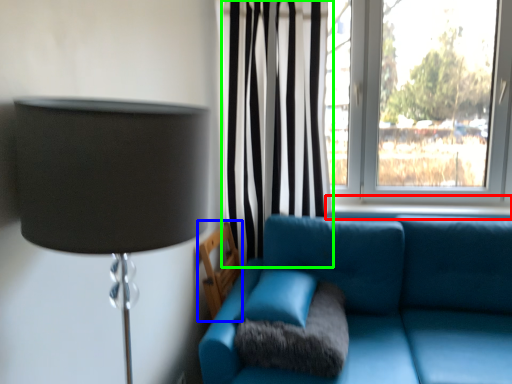
Question: Which object is positioned farthest from window sill (highlighted by a red box)? Select from armchair (highlighted by a blue box) and curtain (highlighted by a green box).

Choices:
 (A) armchair
 (B) curtain

Answer: (A)